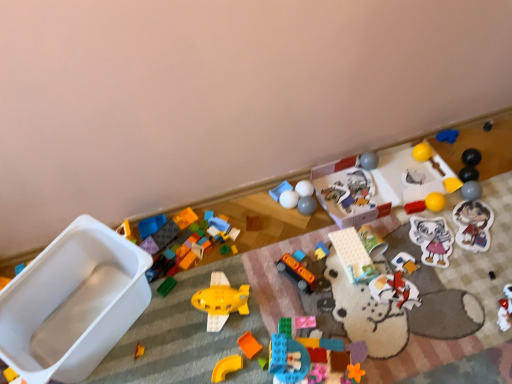
Find the location of a particular element. The height and width of the screenshot is (384, 512). vacant space that is in between white matte figure at center, the nineteenth toy viewed from the left, and yellow plastic airplane at center, placed as the fourth toy when sorted from left to right is located at coordinates (314, 298).